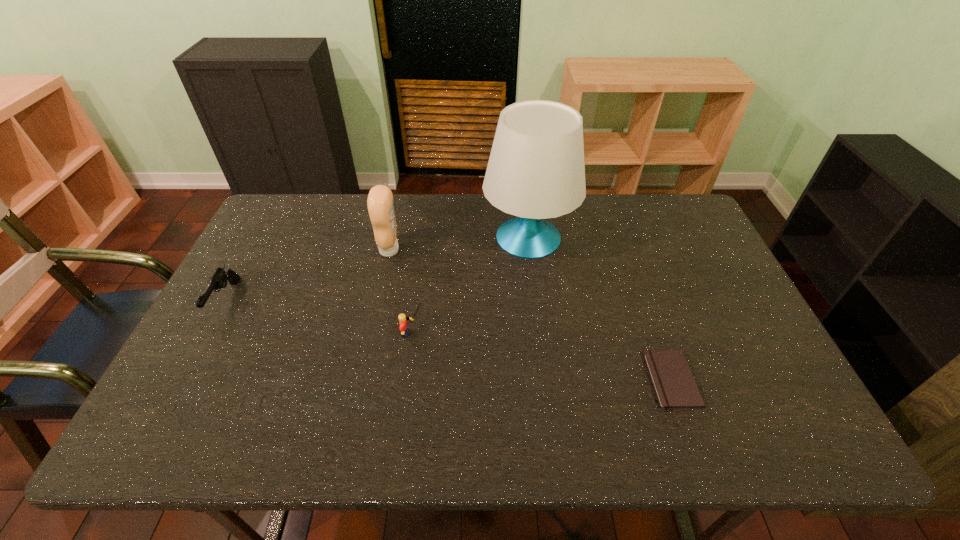
Identify the location of free region at the right edge of the desktop. This screenshot has height=540, width=960. (683, 266).

In the image, there is a desktop. Where is `vacant space at the near left corner`? vacant space at the near left corner is located at coordinates (165, 446).

In the image, there is a desktop. What are the coordinates of `vacant space at the far right corner` in the screenshot? It's located at (639, 194).

The image size is (960, 540). Identify the location of free area in between the checkbook and the Lego. (542, 356).

Locate an element on the screen. The width and height of the screenshot is (960, 540). unoccupied position between the rightmost object and the second object from left to right is located at coordinates (531, 315).

The image size is (960, 540). Find the location of `vacant point located between the nearest object and the fourth object from left to right`. vacant point located between the nearest object and the fourth object from left to right is located at coordinates (600, 309).

Identify the location of vacant area that lies between the leftmost object and the condiment. (307, 275).

Locate an element on the screen. Image resolution: width=960 pixels, height=540 pixels. empty space between the third object from right to left and the second object from right to left is located at coordinates (470, 285).

Where is `unoccupied position between the tallest object and the gun`? The width and height of the screenshot is (960, 540). unoccupied position between the tallest object and the gun is located at coordinates (377, 269).

Locate an element on the screen. Image resolution: width=960 pixels, height=540 pixels. unoccupied area between the shortest object and the second object from left to right is located at coordinates (531, 315).